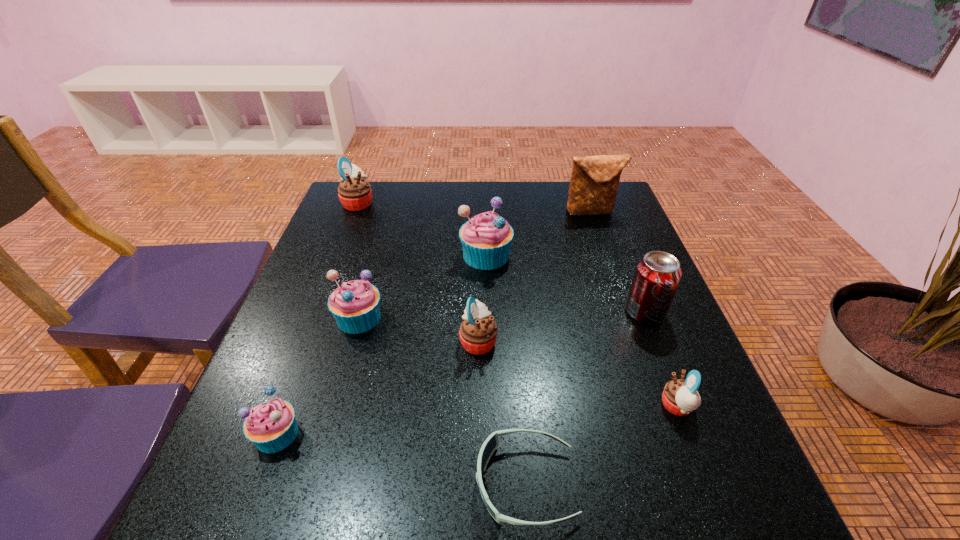
Where is `soda can that is at the right edge`? soda can that is at the right edge is located at coordinates (657, 275).

You are a GUI agent. You are given a task and a screenshot of the screen. Output one action in this format:
    pyautogui.click(x=<x>, y=<y>)
    Task: Click on the muffin located at the right edge
    The height and width of the screenshot is (540, 960).
    Given the screenshot: What is the action you would take?
    pyautogui.click(x=680, y=397)

Identify the location of object at the far left corner. (354, 192).

You are a GUI agent. You are given a task and a screenshot of the screen. Output one action in this format:
    pyautogui.click(x=<x>, y=<y>)
    Task: Click on the object at the far right corner
    This screenshot has height=540, width=960.
    Given the screenshot: What is the action you would take?
    pyautogui.click(x=594, y=182)

The height and width of the screenshot is (540, 960). What are the coordinates of `free spot at the far edge of the desktop` in the screenshot? It's located at coord(551,199).

In the image, there is a desktop. Find the location of `vacant area at the left edge`. vacant area at the left edge is located at coordinates (300, 287).

The width and height of the screenshot is (960, 540). In the image, there is a desktop. Find the location of `vacant space at the right edge`. vacant space at the right edge is located at coordinates (588, 227).

Where is `free space at the far left corner of the desktop`? This screenshot has width=960, height=540. free space at the far left corner of the desktop is located at coordinates (377, 191).

Where is `vacant space that is in between the goggles and the soda can`? vacant space that is in between the goggles and the soda can is located at coordinates (586, 397).

Where is `blank region between the soda can and the clutch bag`? blank region between the soda can and the clutch bag is located at coordinates (618, 262).